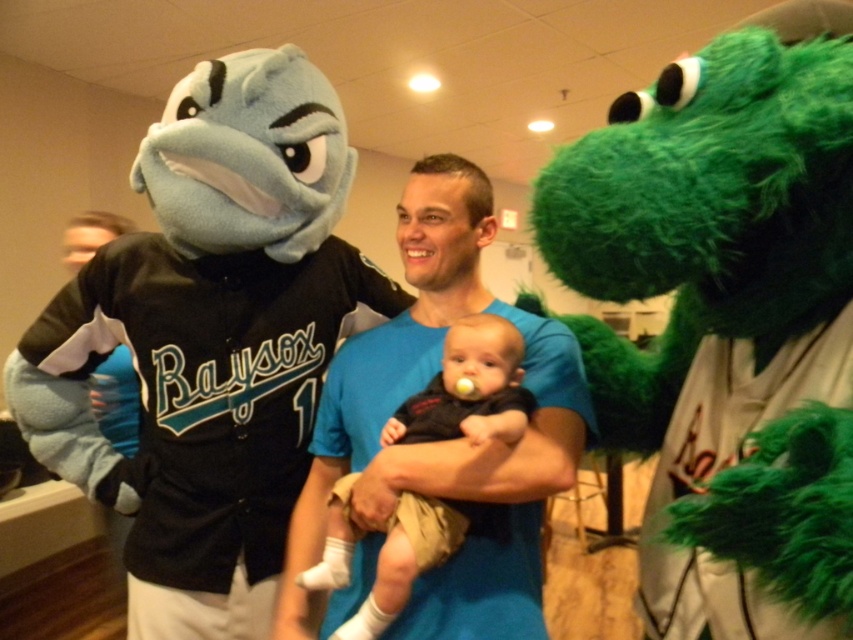
Is green furry creature at right positioned before black jersey at left?

Yes, it is in front of black jersey at left.

Find the location of a particular element. green furry creature at right is located at coordinates (724, 328).

Who is more forward, [686,474] or [563,410]?

Positioned in front is point [686,474].

Is green furry creature at right positioned at the back of blue cotton shirt at center?

That is False.

At what (x,y) coordinates should I click in order to perform the action: click on green furry creature at right. Please return your answer as a coordinate pair (x, y). Looking at the image, I should click on (724, 328).

Does black jersey at left have a smaller size compared to blue cotton shirt at center?

Incorrect, black jersey at left is not smaller in size than blue cotton shirt at center.

Who is positioned more to the right, black jersey at left or blue cotton shirt at center?

blue cotton shirt at center is more to the right.

The height and width of the screenshot is (640, 853). Describe the element at coordinates (195, 410) in the screenshot. I see `black jersey at left` at that location.

This screenshot has height=640, width=853. I want to click on black jersey at left, so (x=195, y=410).